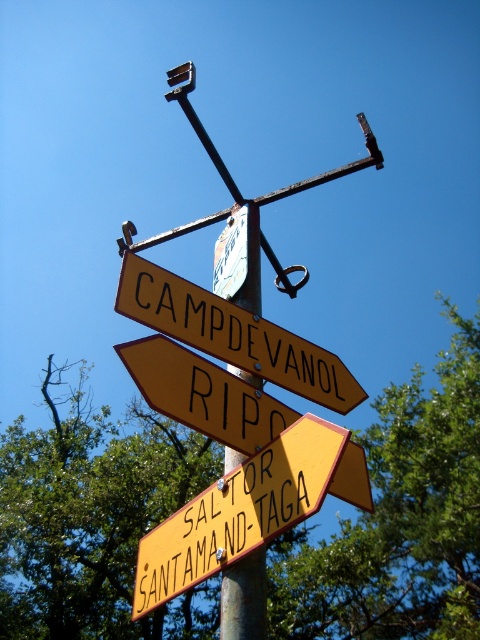
Question: Which of the following is the farthest from the observer?

Choices:
 (A) (264, 509)
 (B) (347, 460)
 (C) (380, 532)

Answer: (C)

Question: Estimate the real-world distances between objects in this image. Which object is closer to the yellow painted wood sign at lower right?

Choices:
 (A) green leafy tree at upper center
 (B) yellow matte signpost at center

Answer: (B)

Question: Is yellow painted wood sign at lower right positioned in front of yellow matte signpost at upper center?

Choices:
 (A) no
 (B) yes

Answer: (B)

Question: Is yellow painted wood sign at lower right smaller than yellow matte signpost at upper center?

Choices:
 (A) no
 (B) yes

Answer: (B)

Question: Does green leafy tree at upper center appear over yellow painted wood sign at lower right?

Choices:
 (A) no
 (B) yes

Answer: (A)

Question: Estimate the real-world distances between objects in this image. Which object is farther from the green leafy tree at upper center?

Choices:
 (A) yellow matte signpost at upper center
 (B) yellow matte signpost at center
 (C) yellow painted wood sign at lower right

Answer: (C)